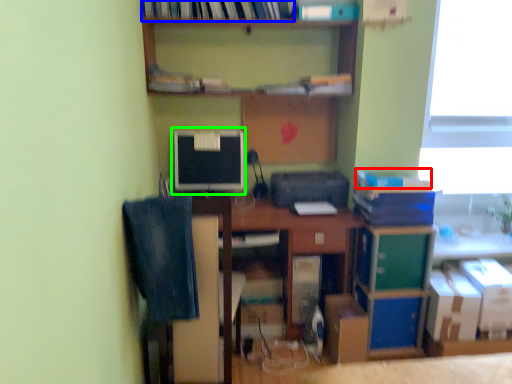
Question: Which is farther away from book (highlighted by a red box)? book (highlighted by a blue box) or computer monitor (highlighted by a green box)?

Choices:
 (A) book
 (B) computer monitor

Answer: (A)